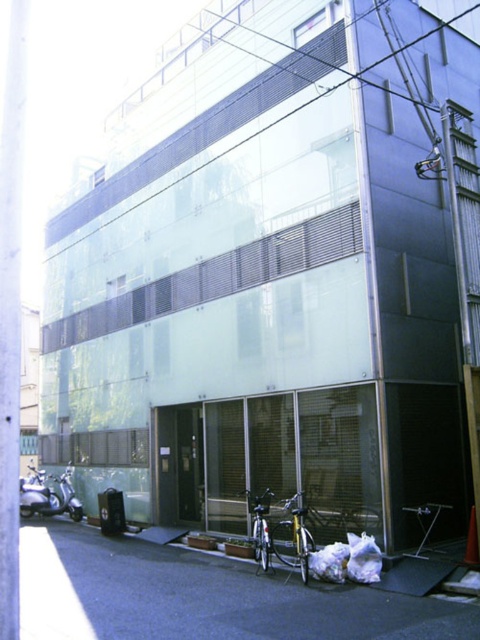
Question: Does yellow metallic bicycle at lower center appear under silver metallic bicycle at lower center?

Choices:
 (A) no
 (B) yes

Answer: (A)

Question: Is yellow metallic bicycle at lower center to the right of silver metallic bicycle at lower center from the viewer's perspective?

Choices:
 (A) yes
 (B) no

Answer: (A)

Question: Is yellow metallic bicycle at lower center smaller than silver metallic bicycle at lower center?

Choices:
 (A) yes
 (B) no

Answer: (B)

Question: Among these objects, which one is farthest from the camera?

Choices:
 (A) silver metallic bicycle at lower center
 (B) yellow metallic bicycle at lower center

Answer: (B)